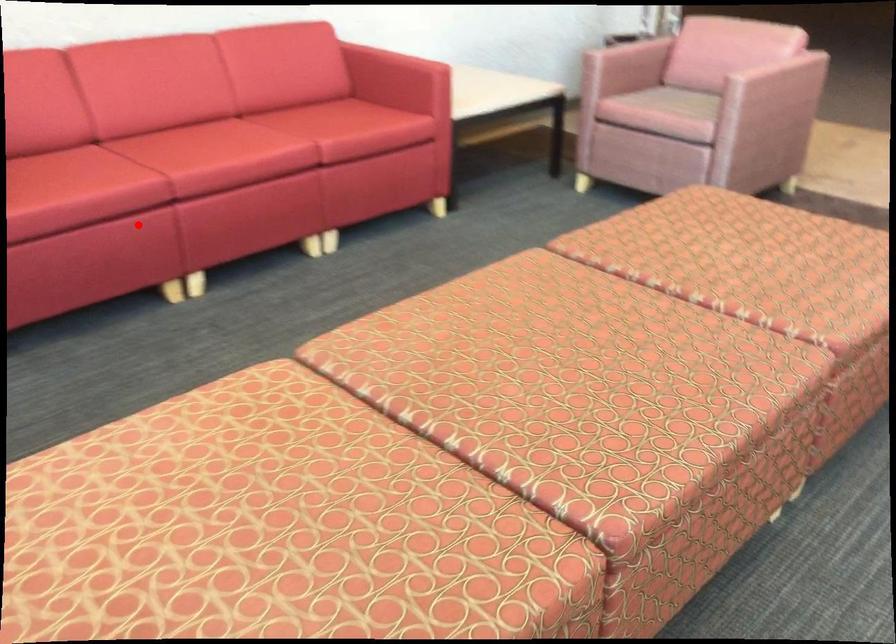
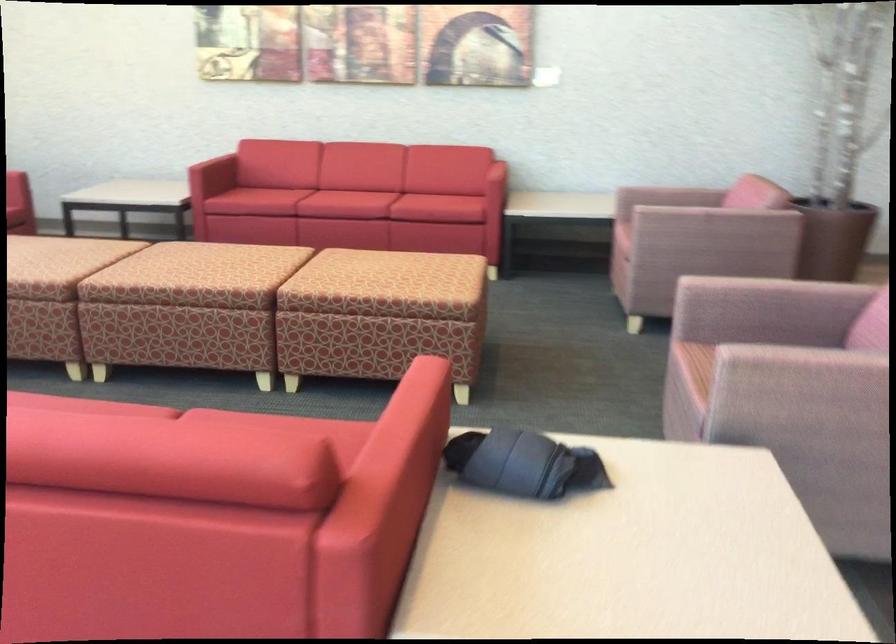
Question: A red point is marked in image1. In image2, is the corresponding 3D point closer to the camera or farther? Reply with the corresponding letter.

Choices:
 (A) The corresponding 3D point is closer.
 (B) The corresponding 3D point is farther.

Answer: (B)